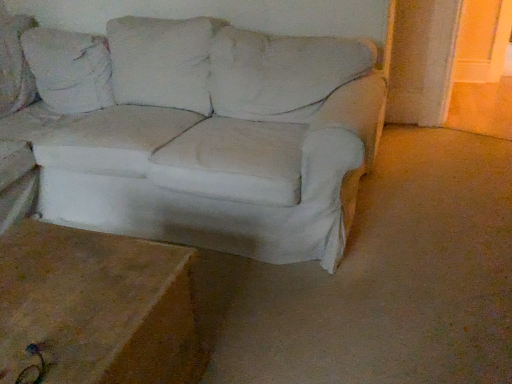
Question: Does brown wood table at lower left have a smaller size compared to white fabric couch at center?

Choices:
 (A) no
 (B) yes

Answer: (B)

Question: Are brown wood table at lower left and white fabric couch at center beside each other?

Choices:
 (A) yes
 (B) no

Answer: (B)

Question: Does brown wood table at lower left appear on the right side of white fabric couch at center?

Choices:
 (A) yes
 (B) no

Answer: (B)

Question: Considering the relative positions of brown wood table at lower left and white fabric couch at center in the image provided, is brown wood table at lower left to the left of white fabric couch at center from the viewer's perspective?

Choices:
 (A) no
 (B) yes

Answer: (B)

Question: Does brown wood table at lower left have a greater width compared to white fabric couch at center?

Choices:
 (A) yes
 (B) no

Answer: (B)

Question: Is brown wood table at lower left oriented towards white fabric couch at center?

Choices:
 (A) yes
 (B) no

Answer: (B)

Question: Does white fabric couch at center appear on the right side of brown wood table at lower left?

Choices:
 (A) no
 (B) yes

Answer: (B)

Question: Is white fabric couch at center completely or partially outside of brown wood table at lower left?

Choices:
 (A) no
 (B) yes

Answer: (B)

Question: Is white fabric couch at center not near brown wood table at lower left?

Choices:
 (A) no
 (B) yes

Answer: (A)

Question: Considering the relative sizes of white fabric couch at center and brown wood table at lower left in the image provided, is white fabric couch at center bigger than brown wood table at lower left?

Choices:
 (A) no
 (B) yes

Answer: (B)

Question: Is white fabric couch at center positioned before brown wood table at lower left?

Choices:
 (A) yes
 (B) no

Answer: (B)

Question: Is white fabric couch at center beside brown wood table at lower left?

Choices:
 (A) no
 (B) yes

Answer: (A)

Question: Based on their sizes in the image, would you say white fabric couch at center is bigger or smaller than brown wood table at lower left?

Choices:
 (A) small
 (B) big

Answer: (B)